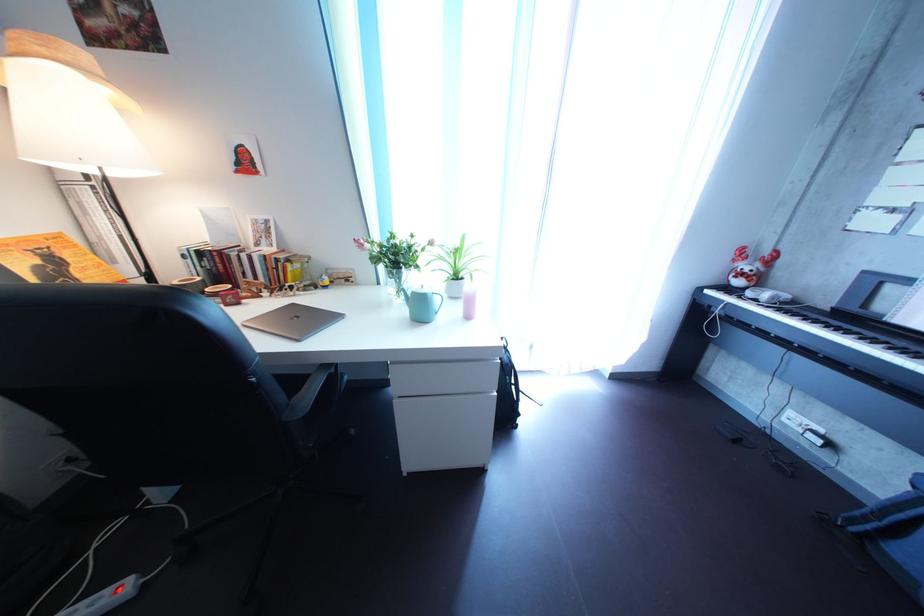
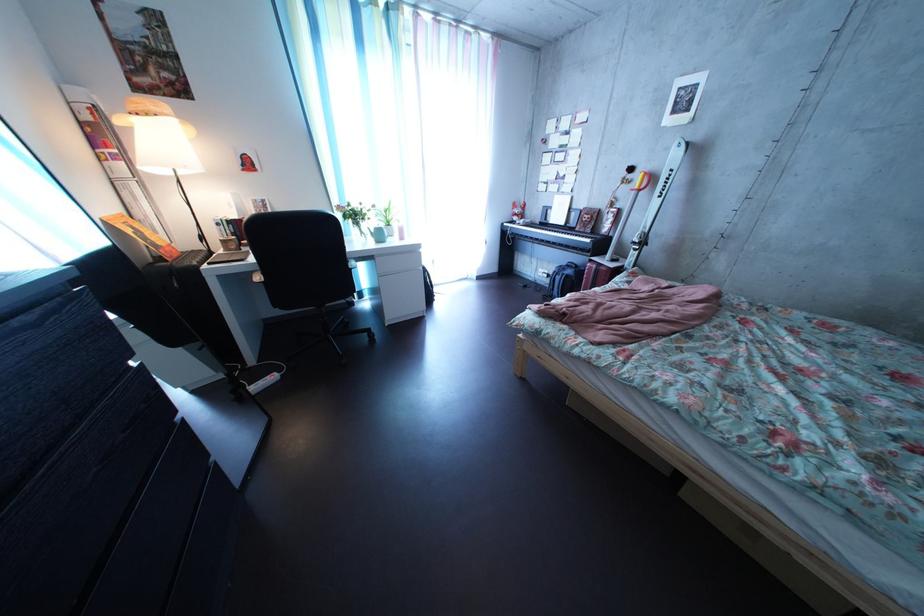
The images are taken continuously from a first-person perspective. In which direction are you moving?

The movement direction of the cameraman is left, backward.